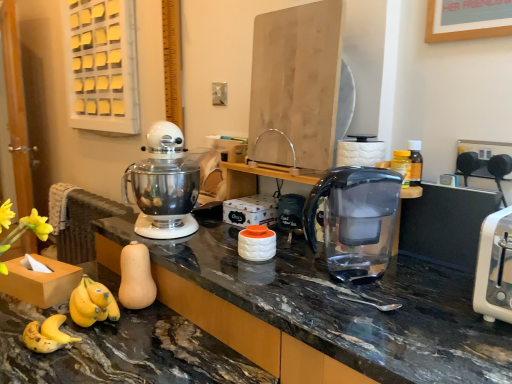
Where is `vacant area that lies between white plastic toaster at right and transparent plastic water filter pitcher at center`? vacant area that lies between white plastic toaster at right and transparent plastic water filter pitcher at center is located at coordinates (418, 295).